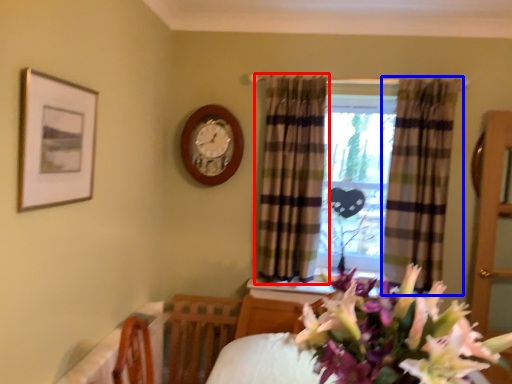
Question: Which of the following is the farthest to the observer, curtain (highlighted by a red box) or curtain (highlighted by a blue box)?

Choices:
 (A) curtain
 (B) curtain

Answer: (A)